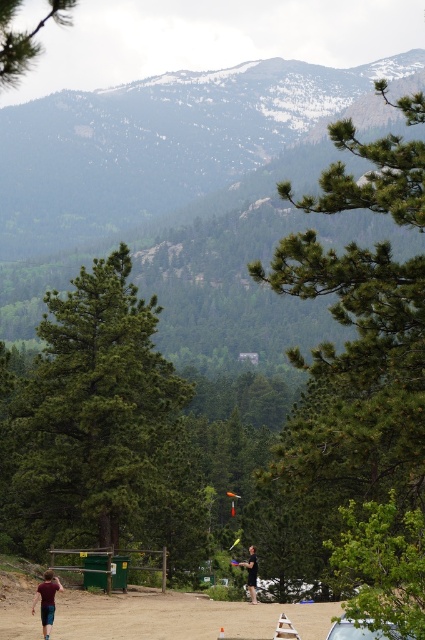
Question: Estimate the real-world distances between objects in this image. Which object is farther from the black fabric shirt at lower center?

Choices:
 (A) metallic silver car at lower right
 (B) brown sandy dirt at lower center
 (C) green rough bark tree at center

Answer: (A)

Question: Does maroon t-shirt at lower left appear on the left side of black fabric shirt at lower center?

Choices:
 (A) no
 (B) yes

Answer: (B)

Question: Is maroon t-shirt at lower left to the right of black fabric shirt at lower center from the viewer's perspective?

Choices:
 (A) no
 (B) yes

Answer: (A)

Question: Can you confirm if green leafy tree at upper left is bigger than metallic silver car at lower right?

Choices:
 (A) yes
 (B) no

Answer: (A)

Question: Among these objects, which one is farthest from the camera?

Choices:
 (A) maroon t-shirt at lower left
 (B) brown sandy dirt at lower center
 (C) green rough bark tree at center

Answer: (C)

Question: Which point appears farthest from the camera in this image?

Choices:
 (A) (139, 486)
 (B) (254, 563)

Answer: (A)